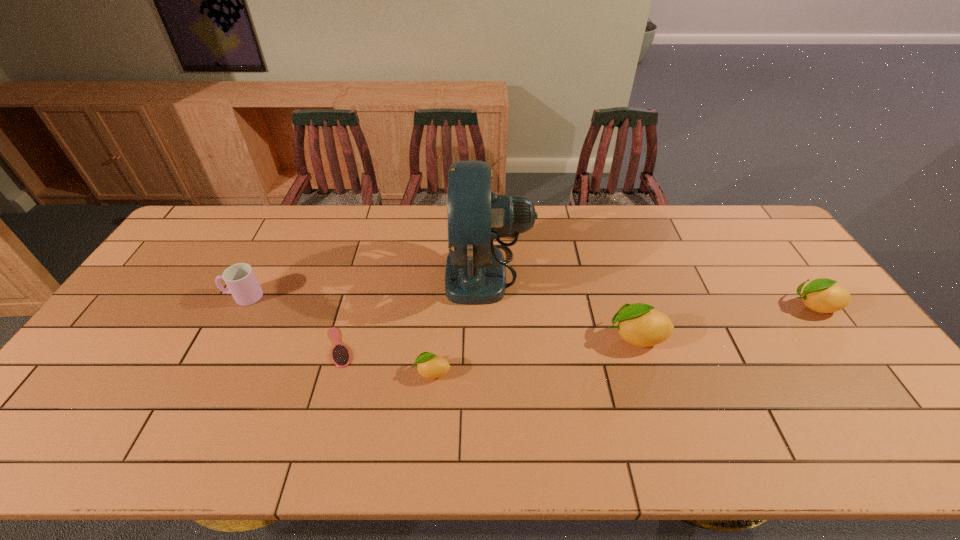
Locate an element on the screen. vacant place for an extra lemon on the left is located at coordinates (197, 413).